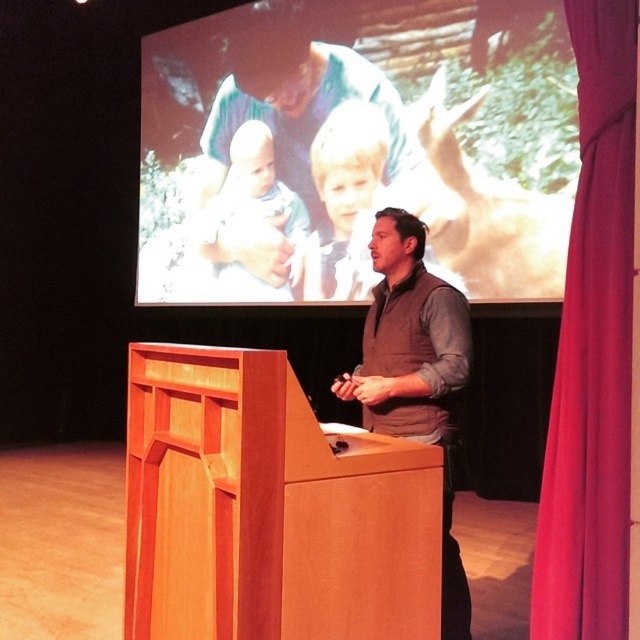
Question: Among these objects, which one is nearest to the camera?

Choices:
 (A) brown vest at center
 (B) smooth white baby at center

Answer: (A)

Question: Can you confirm if matte plastic screen at upper center is bigger than velvet red curtain at right?

Choices:
 (A) no
 (B) yes

Answer: (B)

Question: In this image, where is matte plastic screen at upper center located relative to brown vest at center?

Choices:
 (A) right
 (B) left

Answer: (B)

Question: Which of the following is the farthest from the observer?

Choices:
 (A) matte plastic screen at upper center
 (B) brown vest at center
 (C) light blonde hair at upper center
 (D) wooden podium at center

Answer: (C)

Question: Which point is farther to the camera?

Choices:
 (A) (198, 65)
 (B) (227, 211)
 (C) (337, 211)

Answer: (A)

Question: Does brown vest at center have a lesser width compared to light blonde hair at upper center?

Choices:
 (A) yes
 (B) no

Answer: (A)